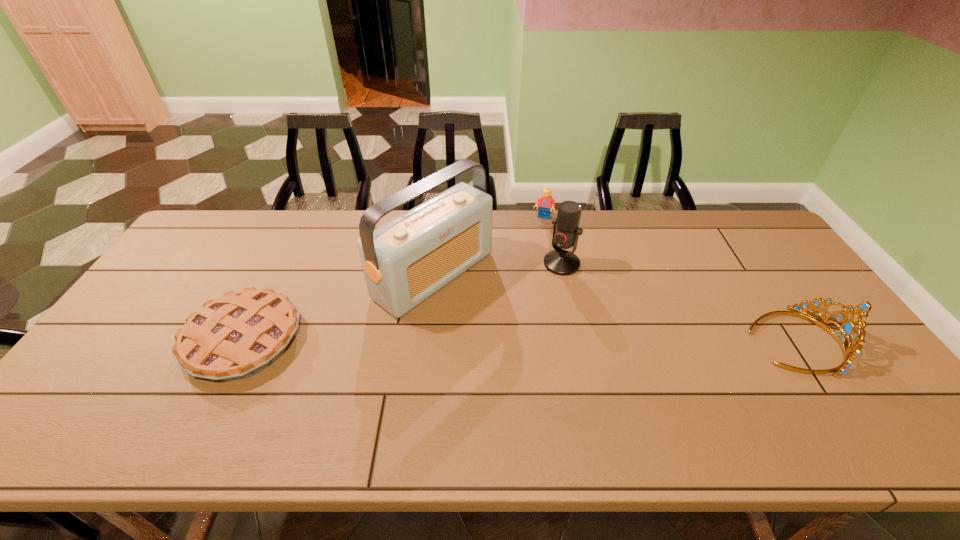
The width and height of the screenshot is (960, 540). I want to click on free space between the radio receiver and the third shortest object, so click(614, 308).

Identify the location of vacant space in between the leftmost object and the rightmost object. This screenshot has width=960, height=540. (519, 340).

Locate an element on the screen. The height and width of the screenshot is (540, 960). free space between the farthest object and the third tallest object is located at coordinates [669, 279].

I want to click on vacant space that is in between the rightmost object and the shortest object, so click(519, 340).

Locate an element on the screen. The width and height of the screenshot is (960, 540). object that stands as the fourth closest to the second tallest object is located at coordinates (236, 336).

Find the location of a particular element. Image resolution: width=960 pixels, height=540 pixels. object that is the fourth closest to the farthest object is located at coordinates (236, 336).

In order to click on vacant region that satisfies the following two spatial constraints: 1. on the front side of the farthest object; 2. on the left side of the fourth shortest object in this screenshot , I will do `click(551, 264)`.

Locate an element on the screen. The image size is (960, 540). vacant region that satisfies the following two spatial constraints: 1. on the front side of the microphone; 2. on the front-facing side of the rightmost object is located at coordinates (577, 341).